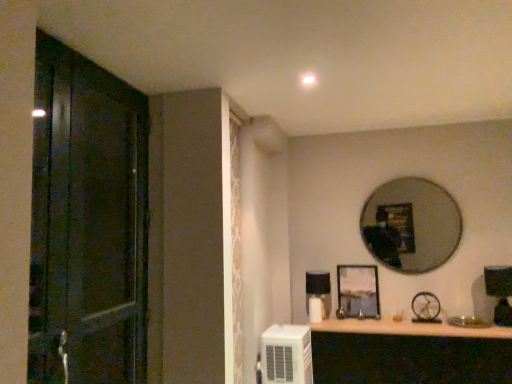
Question: Considering the relative sizes of silver metallic mirror at upper right and metallic silver picture frame at center in the image provided, is silver metallic mirror at upper right shorter than metallic silver picture frame at center?

Choices:
 (A) yes
 (B) no

Answer: (B)

Question: Is silver metallic mirror at upper right directly adjacent to metallic silver picture frame at center?

Choices:
 (A) no
 (B) yes

Answer: (A)

Question: Can you confirm if silver metallic mirror at upper right is positioned to the left of metallic silver picture frame at center?

Choices:
 (A) yes
 (B) no

Answer: (B)

Question: Does silver metallic mirror at upper right have a greater height compared to metallic silver picture frame at center?

Choices:
 (A) no
 (B) yes

Answer: (B)

Question: Does silver metallic mirror at upper right have a smaller size compared to metallic silver picture frame at center?

Choices:
 (A) yes
 (B) no

Answer: (B)

Question: Is silver metallic mirror at upper right thinner than metallic silver picture frame at center?

Choices:
 (A) yes
 (B) no

Answer: (A)

Question: Is white plastic air conditioner at lower right in contact with wooden shelf at lower center?

Choices:
 (A) yes
 (B) no

Answer: (B)

Question: Would you say wooden shelf at lower center is part of white plastic air conditioner at lower right's contents?

Choices:
 (A) yes
 (B) no

Answer: (B)

Question: Is there a large distance between white plastic air conditioner at lower right and wooden shelf at lower center?

Choices:
 (A) yes
 (B) no

Answer: (B)

Question: Can you confirm if white plastic air conditioner at lower right is positioned to the right of wooden shelf at lower center?

Choices:
 (A) no
 (B) yes

Answer: (A)

Question: Is white plastic air conditioner at lower right wider than wooden shelf at lower center?

Choices:
 (A) no
 (B) yes

Answer: (A)

Question: From the image's perspective, is white plastic air conditioner at lower right above wooden shelf at lower center?

Choices:
 (A) no
 (B) yes

Answer: (B)

Question: Is the surface of metallic silver clock at upper right in direct contact with dark wood door at left?

Choices:
 (A) yes
 (B) no

Answer: (B)